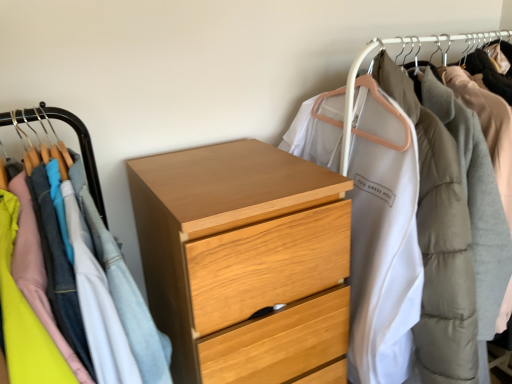
What is the approximate height of light wood chest of drawers at center?

The height of light wood chest of drawers at center is 1.04 meters.

Identify the location of wooden chest of drawers at center, which is the first closet from left to right. click(81, 151).

Looking at this image, considering the relative sizes of wooden chest of drawers at center, which ranks as the second closet in right-to-left order, and white matte coat at upper right, the 2th closet viewed from the left, in the image provided, is wooden chest of drawers at center, which ranks as the second closet in right-to-left order, taller than white matte coat at upper right, the 2th closet viewed from the left,?

No.

Considering their positions, is wooden chest of drawers at center, which ranks as the second closet in right-to-left order, located in front of or behind white matte coat at upper right, the 2th closet viewed from the left?

Clearly, wooden chest of drawers at center, which ranks as the second closet in right-to-left order, is in front of white matte coat at upper right, the 2th closet viewed from the left.

Is wooden chest of drawers at center, which is the first closet from left to right, oriented towards white matte coat at upper right, the 2th closet viewed from the left?

No.

Which is more to the right, wooden chest of drawers at center, which ranks as the second closet in right-to-left order, or white matte coat at upper right, the 2th closet viewed from the left?

white matte coat at upper right, the 2th closet viewed from the left, is more to the right.

Considering the relative sizes of light wood chest of drawers at center and white matte coat at upper right, which is the 1th closet in right-to-left order, in the image provided, is light wood chest of drawers at center smaller than white matte coat at upper right, which is the 1th closet in right-to-left order,?

No.

From the picture: What's the angular difference between light wood chest of drawers at center and white matte coat at upper right, which is the 1th closet in right-to-left order,'s facing directions?

The angle between the facing direction of light wood chest of drawers at center and the facing direction of white matte coat at upper right, which is the 1th closet in right-to-left order, is 0.0575 degrees.

Is light wood chest of drawers at center in contact with white matte coat at upper right, which is the 1th closet in right-to-left order?

No, light wood chest of drawers at center is not making contact with white matte coat at upper right, which is the 1th closet in right-to-left order.

Choose the correct answer: Is light wood chest of drawers at center inside white matte coat at upper right, the 2th closet viewed from the left, or outside it?

light wood chest of drawers at center exists outside the volume of white matte coat at upper right, the 2th closet viewed from the left.

How many degrees apart are the facing directions of white matte coat at upper right, the 2th closet viewed from the left, and wooden chest of drawers at center, which is the first closet from left to right?

The angle between the facing direction of white matte coat at upper right, the 2th closet viewed from the left, and the facing direction of wooden chest of drawers at center, which is the first closet from left to right, is 1.93 degrees.

Is white matte coat at upper right, which is the 1th closet in right-to-left order, inside or outside of wooden chest of drawers at center, which is the first closet from left to right?

The correct answer is: outside.

Which object is closer to the camera taking this photo, white matte coat at upper right, which is the 1th closet in right-to-left order, or wooden chest of drawers at center, which is the first closet from left to right?

Positioned in front is wooden chest of drawers at center, which is the first closet from left to right.

In the scene shown: Considering the relative sizes of white matte coat at upper right, the 2th closet viewed from the left, and light wood chest of drawers at center in the image provided, is white matte coat at upper right, the 2th closet viewed from the left, taller than light wood chest of drawers at center?

Incorrect, the height of white matte coat at upper right, the 2th closet viewed from the left, is not larger of that of light wood chest of drawers at center.

Is white matte coat at upper right, which is the 1th closet in right-to-left order, not close to light wood chest of drawers at center?

Actually, white matte coat at upper right, which is the 1th closet in right-to-left order, and light wood chest of drawers at center are a little close together.

Is white matte coat at upper right, which is the 1th closet in right-to-left order, inside the boundaries of light wood chest of drawers at center, or outside?

The correct answer is: outside.

Consider the image. From a real-world perspective, who is located lower, light wood chest of drawers at center or wooden chest of drawers at center, which is the first closet from left to right?

In real-world perspective, light wood chest of drawers at center is lower.

In terms of height, does light wood chest of drawers at center look taller or shorter compared to wooden chest of drawers at center, which ranks as the second closet in right-to-left order?

Clearly, light wood chest of drawers at center is taller compared to wooden chest of drawers at center, which ranks as the second closet in right-to-left order.

Is wooden chest of drawers at center, which ranks as the second closet in right-to-left order, located within light wood chest of drawers at center?

That's incorrect, wooden chest of drawers at center, which ranks as the second closet in right-to-left order, is not inside light wood chest of drawers at center.

Which object is further away from the camera taking this photo, light wood chest of drawers at center or wooden chest of drawers at center, which ranks as the second closet in right-to-left order?

light wood chest of drawers at center is more distant.

From the image's perspective, is wooden chest of drawers at center, which is the first closet from left to right, located above light wood chest of drawers at center?

Correct, wooden chest of drawers at center, which is the first closet from left to right, appears higher than light wood chest of drawers at center in the image.

Considering the relative positions of wooden chest of drawers at center, which is the first closet from left to right, and light wood chest of drawers at center in the image provided, is wooden chest of drawers at center, which is the first closet from left to right, to the left of light wood chest of drawers at center from the viewer's perspective?

Correct, you'll find wooden chest of drawers at center, which is the first closet from left to right, to the left of light wood chest of drawers at center.

How different are the orientations of wooden chest of drawers at center, which ranks as the second closet in right-to-left order, and light wood chest of drawers at center in degrees?

wooden chest of drawers at center, which ranks as the second closet in right-to-left order, and light wood chest of drawers at center are facing 1.87 degrees away from each other.

Can you confirm if wooden chest of drawers at center, which is the first closet from left to right, is thinner than light wood chest of drawers at center?

No.

Image resolution: width=512 pixels, height=384 pixels. I want to click on closet located above the wooden chest of drawers at center, which is the first closet from left to right (from a real-world perspective), so (x=429, y=164).

Image resolution: width=512 pixels, height=384 pixels. I want to click on the chest of drawers that is below the white matte coat at upper right, which is the 1th closet in right-to-left order (from the image's perspective), so click(243, 260).

Looking at this image, when comparing their distances from light wood chest of drawers at center, does wooden chest of drawers at center, which ranks as the second closet in right-to-left order, or white matte coat at upper right, which is the 1th closet in right-to-left order, seem further?

Based on the image, white matte coat at upper right, which is the 1th closet in right-to-left order, appears to be further to light wood chest of drawers at center.

Based on their spatial positions, is light wood chest of drawers at center or wooden chest of drawers at center, which ranks as the second closet in right-to-left order, further from white matte coat at upper right, which is the 1th closet in right-to-left order?

wooden chest of drawers at center, which ranks as the second closet in right-to-left order, is further to white matte coat at upper right, which is the 1th closet in right-to-left order.

Based on the photo, considering their positions, is white matte coat at upper right, the 2th closet viewed from the left, positioned further to wooden chest of drawers at center, which is the first closet from left to right, than light wood chest of drawers at center?

white matte coat at upper right, the 2th closet viewed from the left, lies further to wooden chest of drawers at center, which is the first closet from left to right, than the other object.

Estimate the real-world distances between objects in this image. Which object is further from light wood chest of drawers at center, white matte coat at upper right, the 2th closet viewed from the left, or wooden chest of drawers at center, which is the first closet from left to right?

white matte coat at upper right, the 2th closet viewed from the left, is positioned further to the anchor light wood chest of drawers at center.

Considering their positions, is wooden chest of drawers at center, which ranks as the second closet in right-to-left order, positioned further to white matte coat at upper right, the 2th closet viewed from the left, than light wood chest of drawers at center?

wooden chest of drawers at center, which ranks as the second closet in right-to-left order, lies further to white matte coat at upper right, the 2th closet viewed from the left, than the other object.

Considering their positions, is light wood chest of drawers at center positioned further to wooden chest of drawers at center, which ranks as the second closet in right-to-left order, than white matte coat at upper right, which is the 1th closet in right-to-left order?

Among the two, white matte coat at upper right, which is the 1th closet in right-to-left order, is located further to wooden chest of drawers at center, which ranks as the second closet in right-to-left order.

Locate an element on the screen. the chest of drawers situated between wooden chest of drawers at center, which is the first closet from left to right, and white matte coat at upper right, which is the 1th closet in right-to-left order, from left to right is located at coordinates (243, 260).